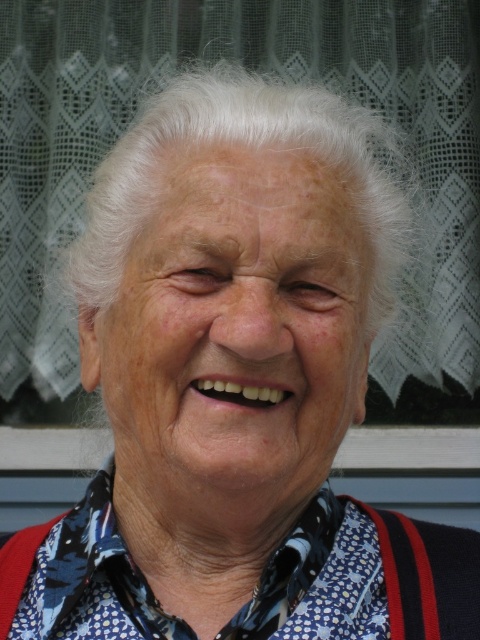
Question: Does blue printed fabric shirt at center have a larger size compared to light brown skin at center?

Choices:
 (A) no
 (B) yes

Answer: (B)

Question: Does white matte face at center appear on the left side of blue printed fabric shirt at center?

Choices:
 (A) no
 (B) yes

Answer: (B)

Question: Among these objects, which one is nearest to the camera?

Choices:
 (A) light brown skin at center
 (B) transparent glass window at upper center
 (C) white matte face at center

Answer: (C)

Question: Can you confirm if white matte face at center is positioned to the left of dry skin at center?

Choices:
 (A) no
 (B) yes

Answer: (B)

Question: Which point appears farthest from the camera in this image?

Choices:
 (A) (300, 525)
 (B) (199, 353)
 (C) (321, 278)
 (D) (429, 248)

Answer: (D)

Question: Which point is farther to the camera?

Choices:
 (A) light brown skin at center
 (B) dry skin at center

Answer: (B)